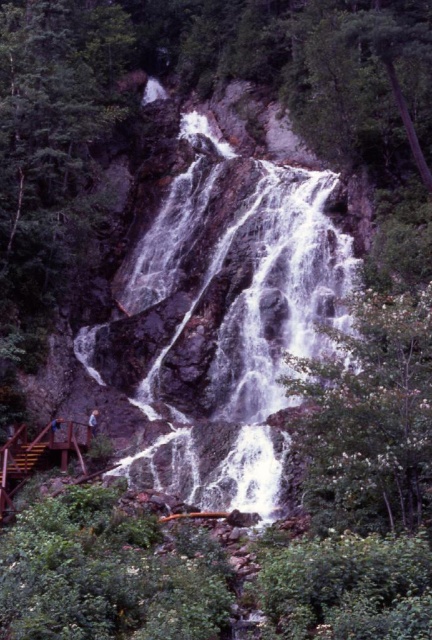
Is white frothy water at center smaller than green leafy tree at center?

Actually, white frothy water at center might be larger than green leafy tree at center.

Is white frothy water at center taller than green leafy tree at center?

Correct, white frothy water at center is much taller as green leafy tree at center.

Is point (146, 269) positioned behind point (386, 346)?

Yes, it is behind point (386, 346).

Identify the location of white frothy water at center. The image size is (432, 640). [254, 340].

Which is more to the left, green leafy tree at center or brown wooden stairs at lower left?

From the viewer's perspective, brown wooden stairs at lower left appears more on the left side.

Is green leafy tree at center to the right of brown wooden stairs at lower left from the viewer's perspective?

Indeed, green leafy tree at center is positioned on the right side of brown wooden stairs at lower left.

Is point (333, 454) more distant than point (35, 444)?

No, it is in front of (35, 444).

At what (x,y) coordinates should I click in order to perform the action: click on green leafy tree at center. Please return your answer as a coordinate pair (x, y). Looking at the image, I should click on (369, 417).

Does white frothy water at center have a smaller size compared to brown wooden stairs at lower left?

Incorrect, white frothy water at center is not smaller in size than brown wooden stairs at lower left.

What do you see at coordinates (254, 340) in the screenshot? I see `white frothy water at center` at bounding box center [254, 340].

Where is `white frothy water at center`? white frothy water at center is located at coordinates (254, 340).